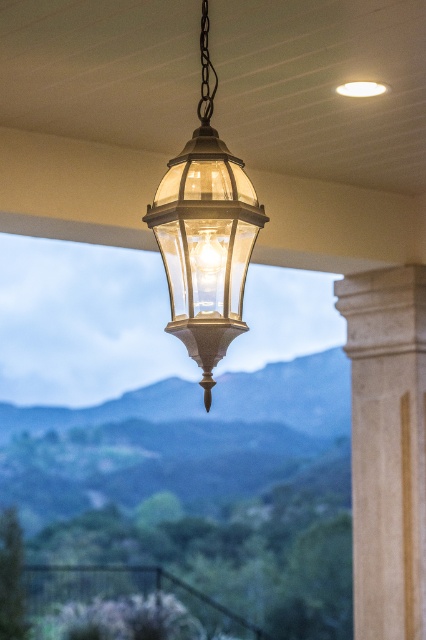
Is matte glass lantern at center shorter than translucent glass lantern at center?

Incorrect, matte glass lantern at center's height does not fall short of translucent glass lantern at center's.

Between matte glass lantern at center and translucent glass lantern at center, which one appears on the right side from the viewer's perspective?

Positioned to the right is translucent glass lantern at center.

What do you see at coordinates (204, 228) in the screenshot? I see `matte glass lantern at center` at bounding box center [204, 228].

Find the location of a particular element. matte glass lantern at center is located at coordinates pos(204,228).

Which is in front, point (420, 387) or point (219, 243)?

Point (219, 243)

Between white marble column at right and translucent glass lantern at center, which one is positioned lower?

white marble column at right

Which is behind, point (382, 493) or point (210, 273)?

The point (382, 493) is behind.

You are a GUI agent. You are given a task and a screenshot of the screen. Output one action in this format:
    pyautogui.click(x=<x>, y=<y>)
    Task: Click on the white marble column at right
    This screenshot has height=640, width=426.
    Given the screenshot: What is the action you would take?
    pyautogui.click(x=386, y=448)

What are the coordinates of `green textured mountains at center` in the screenshot? It's located at (201, 488).

Can you confirm if green textured mountains at center is shorter than matte glass lantern at center?

No, green textured mountains at center is not shorter than matte glass lantern at center.

Is point (26, 424) in front of point (201, 68)?

No, it is not.

At what (x,y) coordinates should I click in order to perform the action: click on green textured mountains at center. Please return your answer as a coordinate pair (x, y). Image resolution: width=426 pixels, height=640 pixels. Looking at the image, I should click on (201, 488).